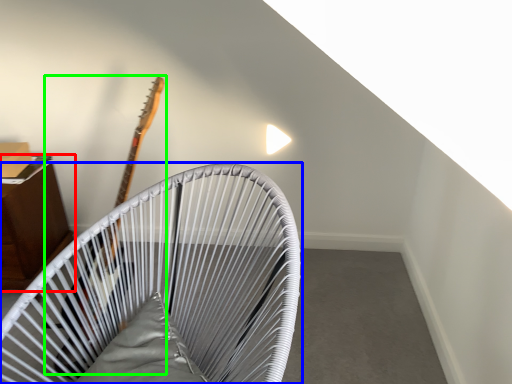
Question: Which object is positioned farthest from furniture (highlighted by a red box)? Select from furniture (highlighted by a blue box) and guitar (highlighted by a green box).

Choices:
 (A) furniture
 (B) guitar

Answer: (A)